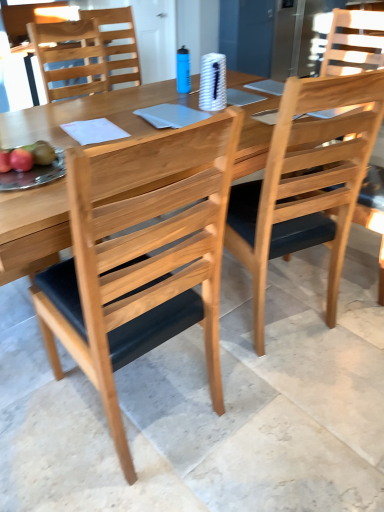
At what (x,y) coordinates should I click in order to perform the action: click on vacant region in front of light brown wood chair at center, marked as the second chair in a back-to-front arrangement. Please return your answer as a coordinate pair (x, y). This screenshot has height=512, width=384. Looking at the image, I should click on coord(289,386).